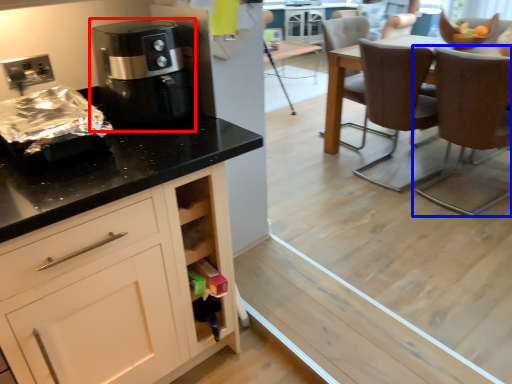
Question: Which point is closer to the camera, coffee machine (highlighted by a red box) or chair (highlighted by a blue box)?

Choices:
 (A) coffee machine
 (B) chair

Answer: (A)